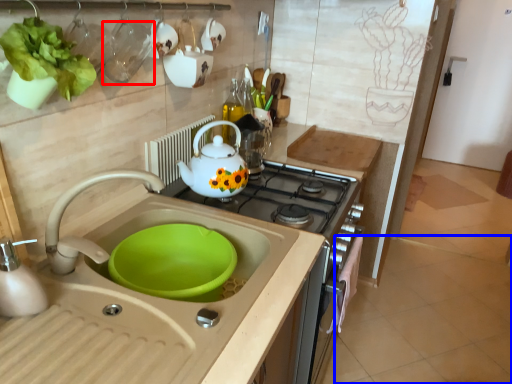
Question: Which of the following is the closest to the observer, tableware (highlighted by a red box) or tile (highlighted by a blue box)?

Choices:
 (A) tableware
 (B) tile

Answer: (A)